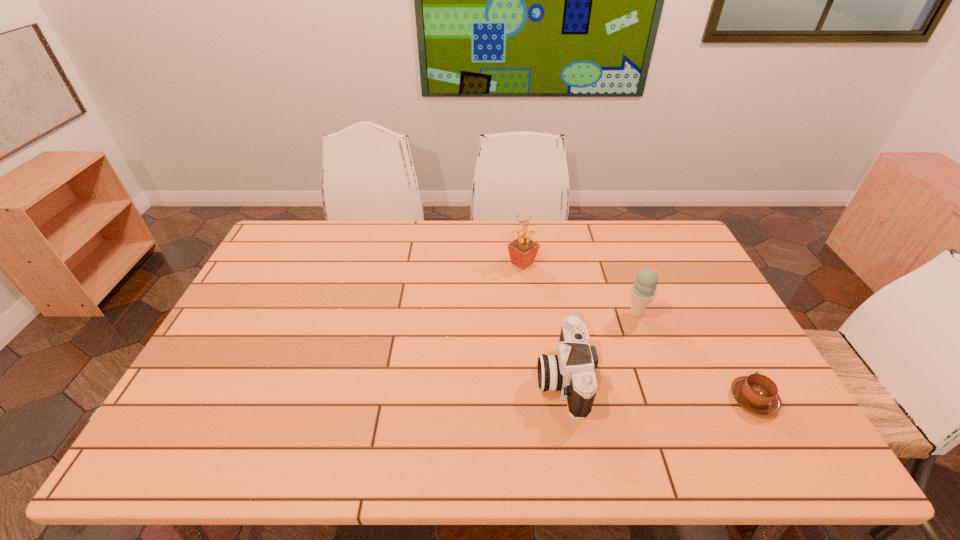
Where is `free space in the image that satisfies the following two spatial constraints: 1. at the front of the ice cream with flowers visible; 2. on the right side of the farthest object`? free space in the image that satisfies the following two spatial constraints: 1. at the front of the ice cream with flowers visible; 2. on the right side of the farthest object is located at coordinates (528, 313).